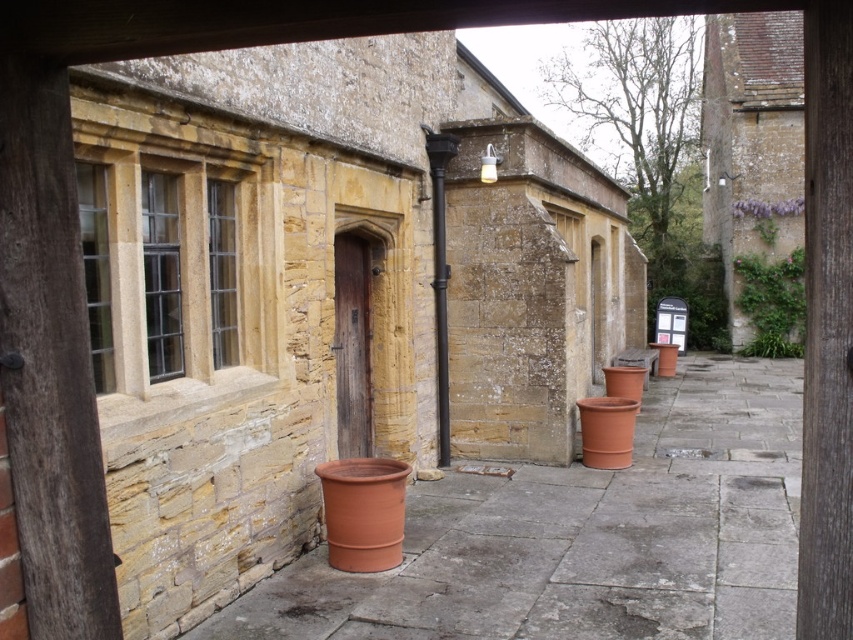
Who is shorter, terracotta clay pot at center or green leafy plant at upper right?

With less height is terracotta clay pot at center.

Is terracotta clay pot at center positioned at the back of green leafy plant at upper right?

No, it is not.

Between point (772, 605) and point (788, 330), which one is positioned in front?

Positioned in front is point (772, 605).

You are a GUI agent. You are given a task and a screenshot of the screen. Output one action in this format:
    pyautogui.click(x=<x>, y=<y>)
    Task: Click on the terracotta clay pot at center
    This screenshot has height=640, width=853.
    Given the screenshot: What is the action you would take?
    pyautogui.click(x=585, y=536)